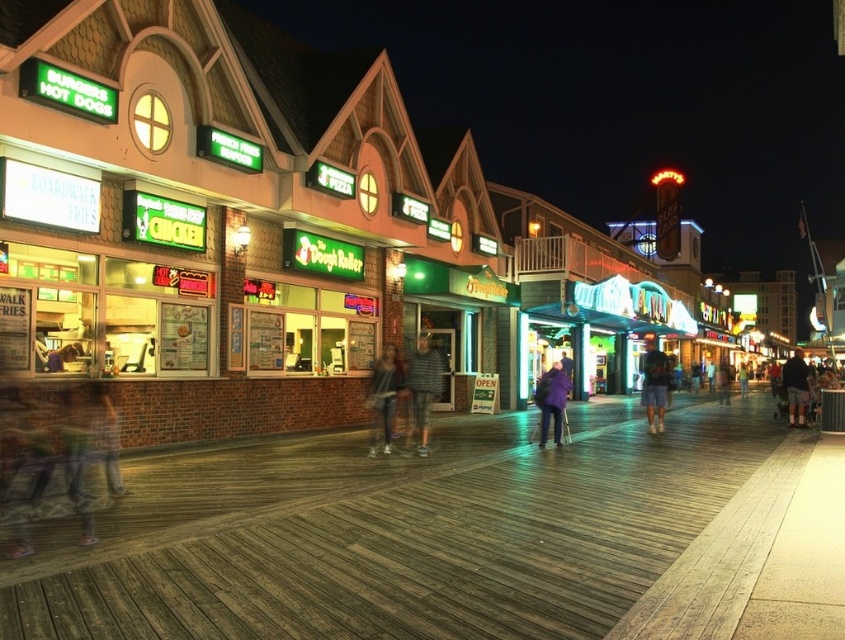
You are a photographer standing at the entrance of the boardwalk. You want to take a photo that includes both the dark blue shorts at center and the dark gray shorts at right. Which of the two should you focus on first if you want to capture both in the frame?

The dark blue shorts at center is positioned on the left side of dark gray shorts at right, so you should focus on the dark blue shorts at center first to ensure both are in the frame.

You are standing on the boardwalk and see a person wearing a striped sweater at center and dark blue shorts at center. Which piece of clothing is nearer to you?

The striped sweater at center is closer to the viewer than the dark blue shorts at center.

You are a fashion blogger who wants to take a photo of the striped sweater at center and denim jacket at center for a winter outfit post. Which item has a narrower width when laid flat?

The striped sweater at center is thinner than the denim jacket at center, so the striped sweater at center has a narrower width when laid flat.